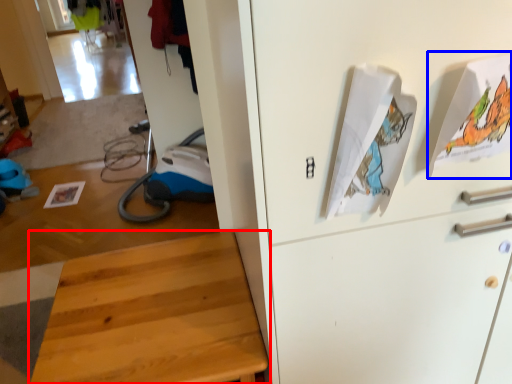
Question: Which of the following is the farthest to the observer, furniture (highlighted by a red box) or wrapping paper (highlighted by a blue box)?

Choices:
 (A) furniture
 (B) wrapping paper

Answer: (A)